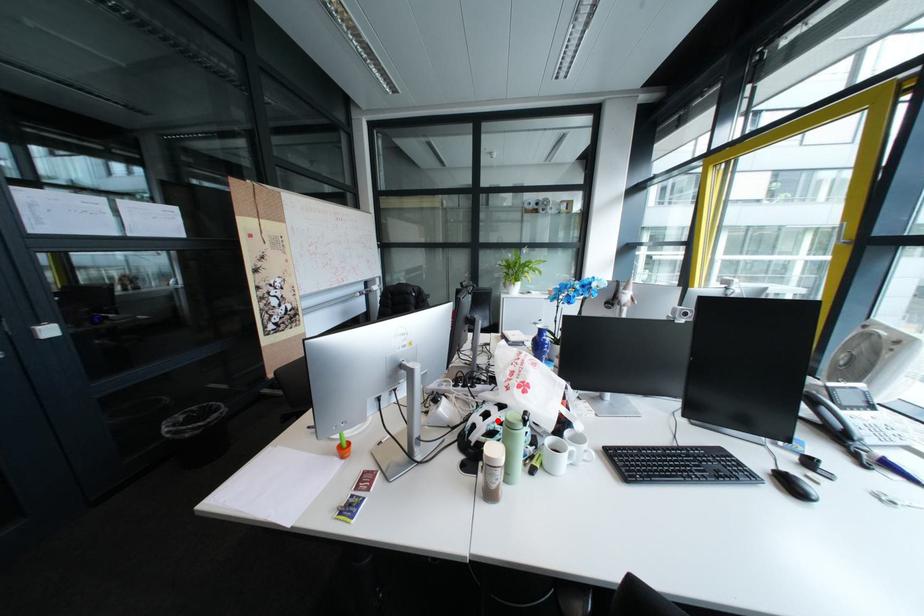
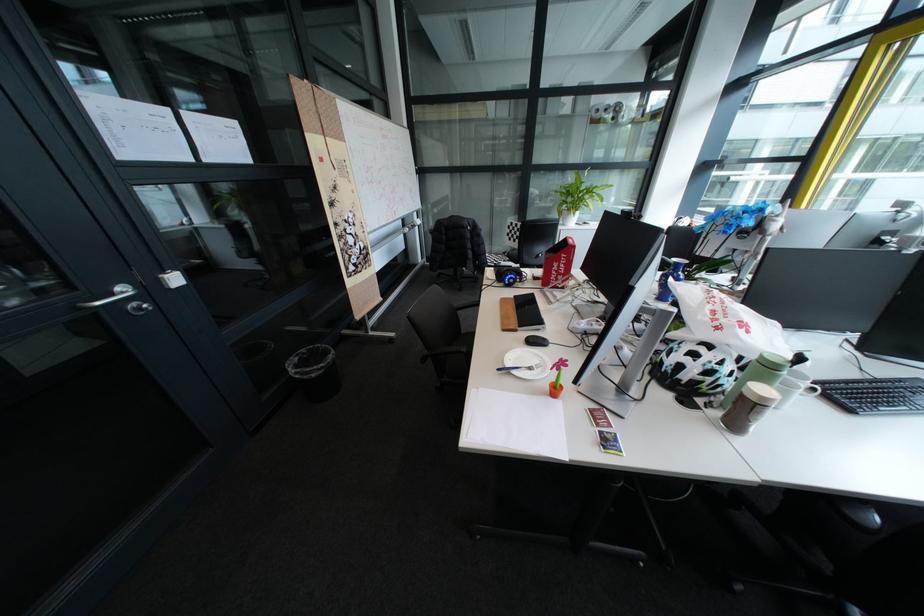
Locate, in the second image, the point that corresponds to the highlighted location in the first image.

(709, 361)